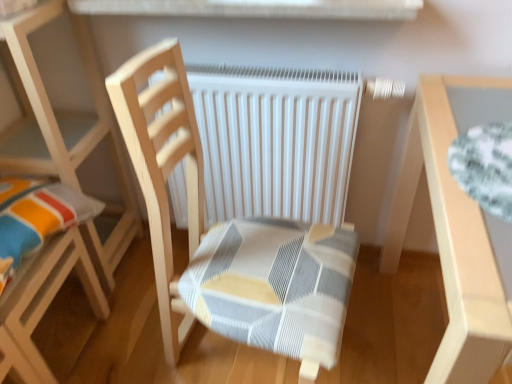
Question: Is point (487, 91) positioned closer to the camera than point (28, 92)?

Choices:
 (A) farther
 (B) closer

Answer: (A)

Question: Is light wood table at right inside or outside of wooden chair at left, the 2th chair in the right-to-left sequence?

Choices:
 (A) inside
 (B) outside

Answer: (B)

Question: Which of these objects is positioned closest to the light wood table at right?

Choices:
 (A) white matte radiator at center
 (B) wooden chair with striped cushion at center, which is counted as the second chair, starting from the left
 (C) white smooth window sill at upper center
 (D) wooden chair at left, the 2th chair in the right-to-left sequence

Answer: (A)

Question: Estimate the real-world distances between objects in this image. Which object is farther from the white matte radiator at center?

Choices:
 (A) wooden chair with striped cushion at center, which is counted as the second chair, starting from the left
 (B) white smooth window sill at upper center
 (C) wooden chair at left, the first chair viewed from the left
 (D) light wood table at right

Answer: (C)